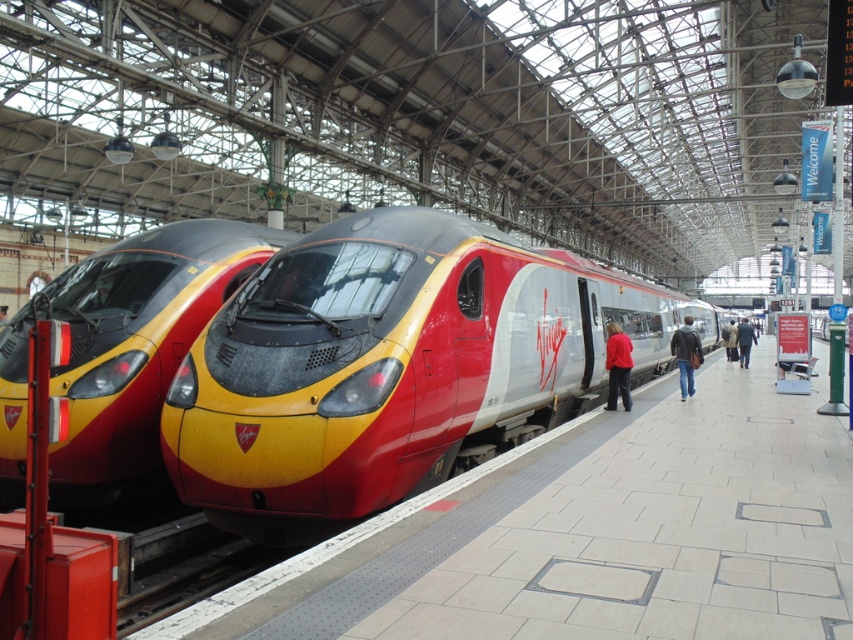
You are a traveler at the train station and you see a leather jacket at platform and a dark blue coat at platform center. Which one is smaller in size?

The leather jacket at platform is smaller in size compared to the dark blue coat at platform center.

You are a passenger waiting at the train station and notice the metallic red train at center and the dark brown leather coat at platform center. Based on their sizes, which object would appear narrower from your perspective?

The metallic red train at center has a lesser width compared to the dark brown leather coat at platform center, so it would appear narrower from your perspective.

You are standing at the train station and see the point marked at coordinates (125, 342). What object is located at that point?

The point at coordinates (125, 342) indicates the metallic red and yellow train at center.